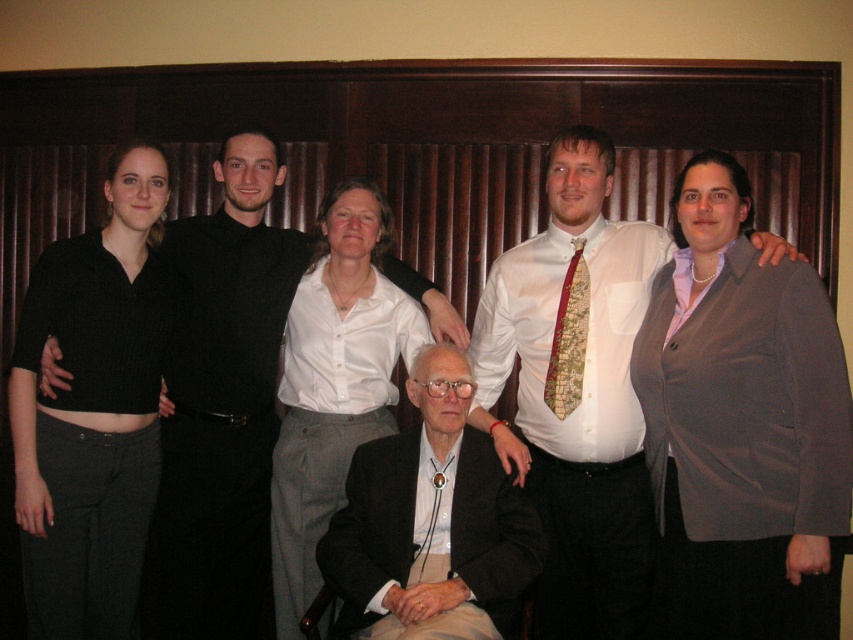
Looking at this image, you are a photographer trying to adjust the lighting for a group photo. You notice two individuals in the front row wearing a matte white shirt at center and a black smooth shirt at left. Which person should you adjust the lighting for to ensure their shirts are properly exposed? Explain your reasoning.

The matte white shirt at center should be adjusted because it is shorter than the black smooth shirt at left, meaning it may be closer to the camera and require different lighting to avoid overexposure.